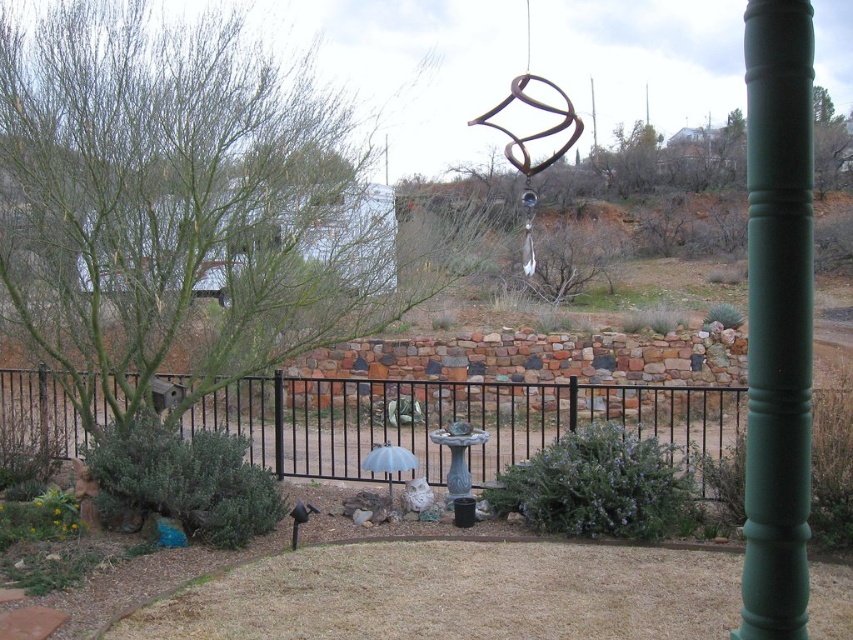
Question: Among these points, which one is nearest to the camera?

Choices:
 (A) (763, 134)
 (B) (36, 413)
 (C) (379, 467)
 (D) (270, 180)

Answer: (A)

Question: Which object is positioned closest to the black metal fence at center?

Choices:
 (A) green leafy tree at center
 (B) blue fabric umbrella at center

Answer: (A)

Question: Is green leafy tree at center smaller than green painted wood post at right?

Choices:
 (A) yes
 (B) no

Answer: (A)

Question: Does black metal fence at center appear over green painted wood post at right?

Choices:
 (A) yes
 (B) no

Answer: (B)

Question: Which object is the closest to the green painted wood post at right?

Choices:
 (A) black metal fence at center
 (B) blue fabric umbrella at center
 (C) green leafy tree at center

Answer: (A)

Question: Does green painted wood post at right have a smaller size compared to blue fabric umbrella at center?

Choices:
 (A) no
 (B) yes

Answer: (A)